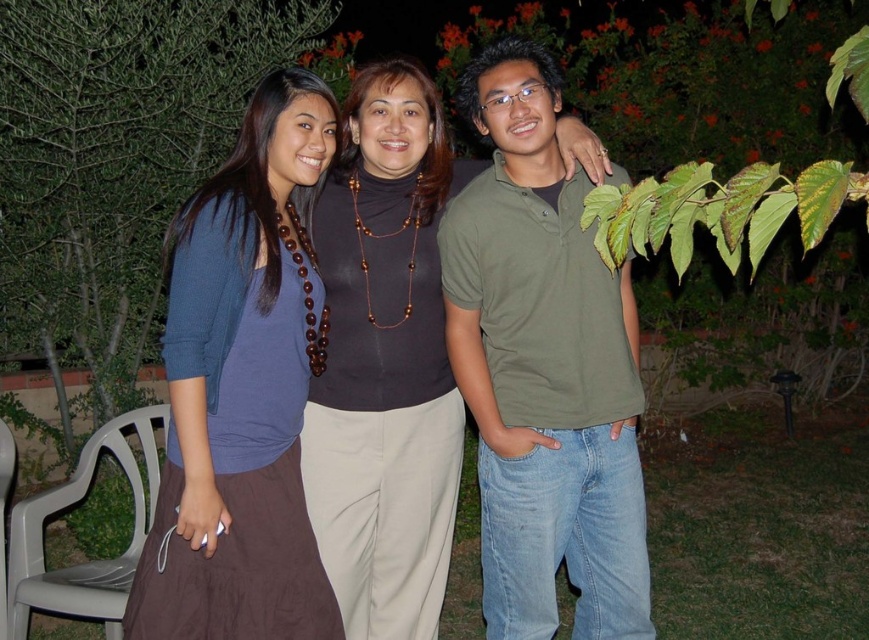
You are standing in the garden and want to take a photo of the point at coordinates (582, 324). If your camera has a focal length of 50mm and you are 2.16 meters away from the point, what is the angle of view required to frame the point perfectly in the center of the photo?

The angle of view required to frame the point at coordinates (582, 324) perfectly in the center would be calculated using the camera specifications and distance. However, without additional details about the sensor size or the desired framing dimensions, an exact angle cannot be determined. Ensure the camera is positioned 2.16 meters away from the point to capture it clearly.